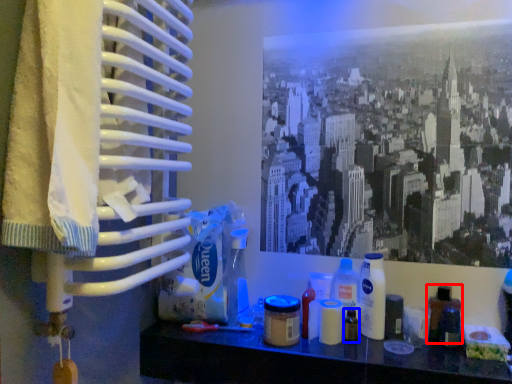
Question: Which of the following is the closest to the observer, bottle (highlighted by a red box) or toiletry (highlighted by a blue box)?

Choices:
 (A) bottle
 (B) toiletry

Answer: (A)